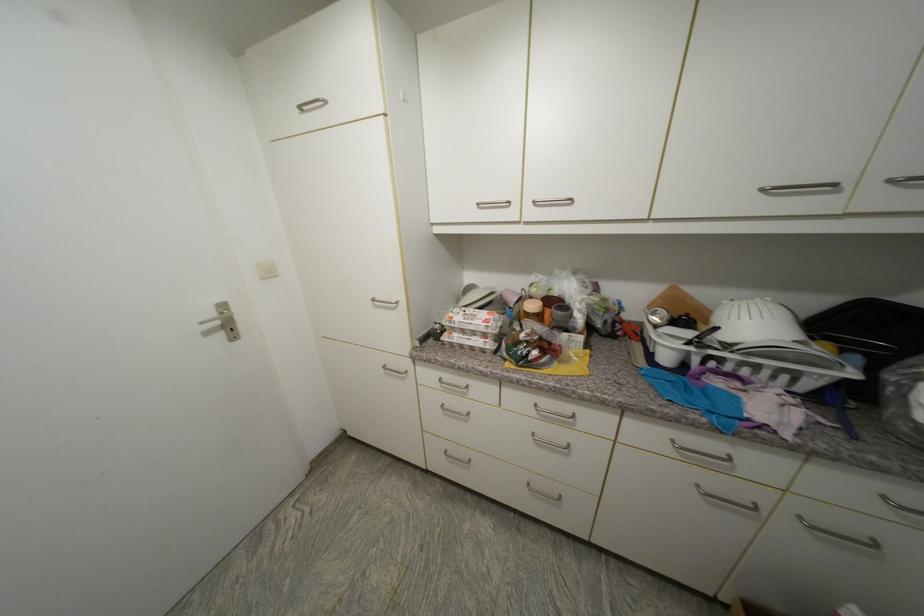
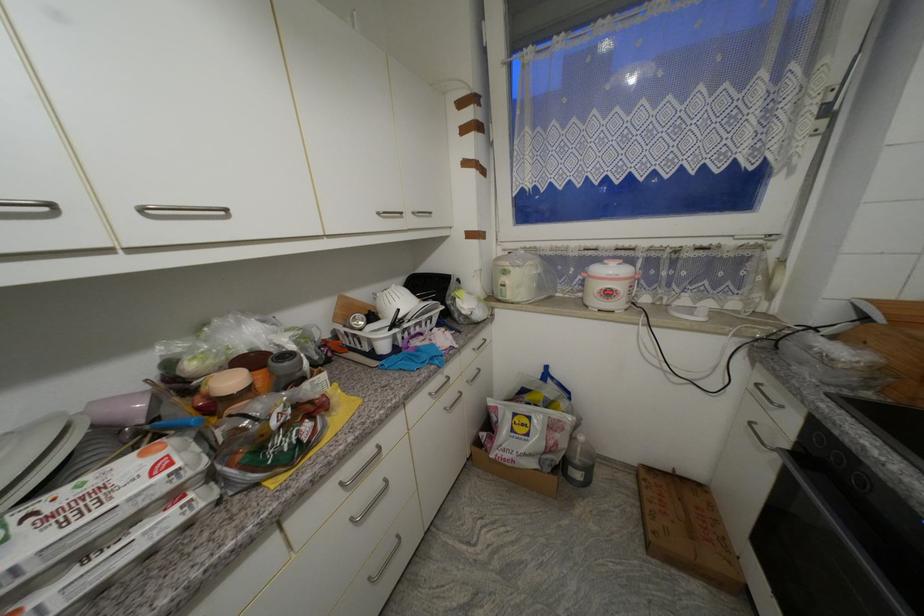
Find the pixel in the second image that matches (751,374) in the first image.

(423, 331)